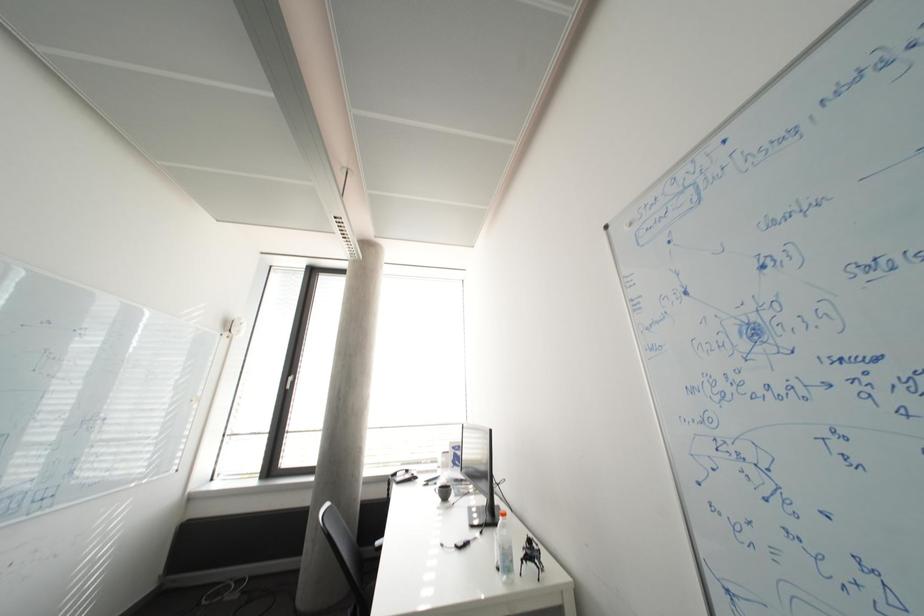
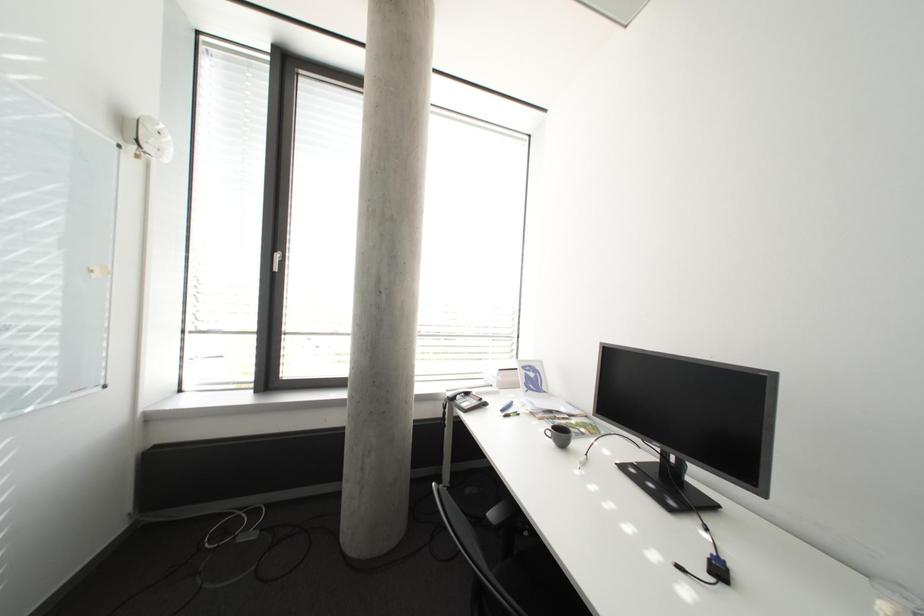
Consider the image. What movement of the cameraman would produce the second image?

The movement direction of the cameraman is left, forward.